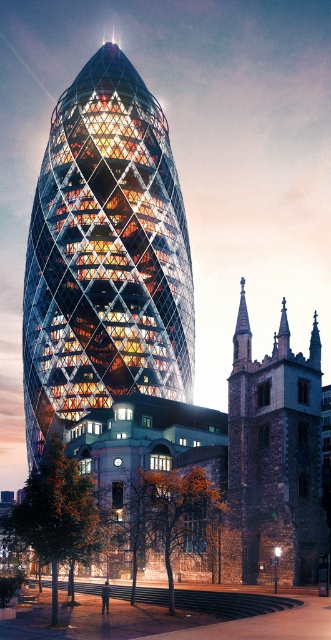
You are a drone operator tasked with capturing aerial footage of the glassy orange building at center. Based on its coordinates, is it positioned closer to the left or right side of the image?

The glassy orange building at center is located at point [104,257], which places it closer to the left side of the image since the x coordinate is less than 0.5.

You are a city planner assessing a new development proposal. The proposal requires knowing whether the glassy orange building at center can be expanded horizontally without encroaching on the dark brown stone tower at lower right. Based on the current dimensions, what do you advise?

The glassy orange building at center is wider than the dark brown stone tower at lower right. Therefore, expanding the glassy orange building at center horizontally might not be feasible without overlapping the dark brown stone tower at lower right, so it is advisable to avoid horizontal expansion to prevent encroachment.

You are an architect analyzing the spatial relationship between the glassy orange building at center and the dark brown stone tower at lower right. Which structure is positioned higher in the image?

The glassy orange building at center is above the dark brown stone tower at lower right, so it is positioned higher in the image.